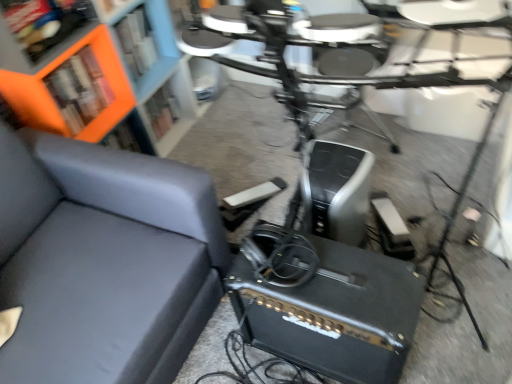
What are the coordinates of `orange matte bookcase at upper left` in the screenshot? It's located at (103, 81).

This screenshot has width=512, height=384. Find the location of `matte gray couch at left`. matte gray couch at left is located at coordinates (103, 261).

Image resolution: width=512 pixels, height=384 pixels. Describe the element at coordinates (325, 304) in the screenshot. I see `black matte speaker at lower center` at that location.

This screenshot has width=512, height=384. I want to click on orange matte bookshelf at upper left, so click(x=161, y=111).

This screenshot has height=384, width=512. I want to click on orange matte bookcase at upper left, so click(103, 81).

From the image's perspective, is orange matte bookshelf at upper left over black matte speaker at lower center?

Yes, from the image's perspective, orange matte bookshelf at upper left is over black matte speaker at lower center.

In the scene shown: Considering the sizes of objects orange matte bookshelf at upper left and black matte speaker at lower center in the image provided, who is thinner, orange matte bookshelf at upper left or black matte speaker at lower center?

With smaller width is orange matte bookshelf at upper left.

Is orange matte bookshelf at upper left to the left or to the right of black matte speaker at lower center in the image?

In the image, orange matte bookshelf at upper left appears on the left side of black matte speaker at lower center.

Considering the relative sizes of orange matte bookshelf at upper left and black matte speaker at lower center in the image provided, is orange matte bookshelf at upper left taller than black matte speaker at lower center?

In fact, orange matte bookshelf at upper left may be shorter than black matte speaker at lower center.

Does point (117, 50) come behind point (139, 190)?

That is True.

Would you say orange matte bookcase at upper left is to the left or to the right of matte gray couch at left in the picture?

In the image, orange matte bookcase at upper left appears on the right side of matte gray couch at left.

Considering the sizes of orange matte bookcase at upper left and matte gray couch at left in the image, is orange matte bookcase at upper left taller or shorter than matte gray couch at left?

orange matte bookcase at upper left is taller than matte gray couch at left.

How distant is orange matte bookcase at upper left from matte gray couch at left?

orange matte bookcase at upper left is 20.56 inches from matte gray couch at left.

Could you tell me if orange matte bookcase at upper left is facing orange matte bookshelf at upper left?

Yes.

From a real-world perspective, which is physically above, orange matte bookcase at upper left or orange matte bookshelf at upper left?

orange matte bookcase at upper left, from a real-world perspective.

Which is more to the right, orange matte bookcase at upper left or orange matte bookshelf at upper left?

orange matte bookshelf at upper left is more to the right.

Is point (137, 139) more distant than point (152, 127)?

No, it is not.

Is orange matte bookshelf at upper left surrounding orange matte bookcase at upper left?

No, orange matte bookcase at upper left is not surrounded by orange matte bookshelf at upper left.

From their relative heights in the image, would you say orange matte bookshelf at upper left is taller or shorter than orange matte bookcase at upper left?

orange matte bookshelf at upper left is shorter than orange matte bookcase at upper left.

I want to click on bookcase on the left of the orange matte bookshelf at upper left, so click(x=103, y=81).

Is orange matte bookshelf at upper left closer to the viewer compared to orange matte bookcase at upper left?

No, it is behind orange matte bookcase at upper left.

Are orange matte bookshelf at upper left and matte gray couch at left making contact?

No, orange matte bookshelf at upper left is not next to matte gray couch at left.

Is orange matte bookshelf at upper left not inside matte gray couch at left?

orange matte bookshelf at upper left lies outside matte gray couch at left's area.

Is orange matte bookshelf at upper left oriented towards matte gray couch at left?

No, orange matte bookshelf at upper left is not turned towards matte gray couch at left.

Is black matte speaker at lower center aimed at orange matte bookshelf at upper left?

No, black matte speaker at lower center is not oriented towards orange matte bookshelf at upper left.

From a real-world perspective, which is physically below, black matte speaker at lower center or orange matte bookshelf at upper left?

orange matte bookshelf at upper left.

Which object is thinner, black matte speaker at lower center or orange matte bookshelf at upper left?

Thinner between the two is orange matte bookshelf at upper left.

Which is in front, point (367, 334) or point (174, 100)?

Point (367, 334)

Looking at this image, is black matte speaker at lower center next to matte gray couch at left?

No.

Does black matte speaker at lower center appear on the right side of matte gray couch at left?

Indeed, black matte speaker at lower center is positioned on the right side of matte gray couch at left.

Is point (278, 292) positioned behind point (68, 321)?

No, (278, 292) is closer to viewer.

The height and width of the screenshot is (384, 512). Find the location of `shelf below the black matte speaker at lower center (from a real-world perspective)`. shelf below the black matte speaker at lower center (from a real-world perspective) is located at coordinates (161, 111).

You are a GUI agent. You are given a task and a screenshot of the screen. Output one action in this format:
    pyautogui.click(x=<x>, y=<y>)
    Task: Click on the chair located below the orange matte bookcase at upper left (from the image's perspective)
    
    Given the screenshot: What is the action you would take?
    pyautogui.click(x=103, y=261)

When comparing their distances from orange matte bookcase at upper left, does black matte speaker at lower center or matte gray couch at left seem closer?

matte gray couch at left lies closer to orange matte bookcase at upper left than the other object.

Which object lies further to the anchor point orange matte bookshelf at upper left, matte gray couch at left or black matte speaker at lower center?

Based on the image, black matte speaker at lower center appears to be further to orange matte bookshelf at upper left.

Which object lies nearer to the anchor point matte gray couch at left, black matte speaker at lower center or orange matte bookshelf at upper left?

black matte speaker at lower center is positioned closer to the anchor matte gray couch at left.

From the image, which object appears to be farther from matte gray couch at left, orange matte bookshelf at upper left or black matte speaker at lower center?

orange matte bookshelf at upper left lies further to matte gray couch at left than the other object.

When comparing their distances from orange matte bookshelf at upper left, does black matte speaker at lower center or orange matte bookcase at upper left seem closer?

orange matte bookcase at upper left.

Based on their spatial positions, is matte gray couch at left or black matte speaker at lower center further from orange matte bookcase at upper left?

black matte speaker at lower center.

Considering their positions, is orange matte bookcase at upper left positioned further to orange matte bookshelf at upper left than matte gray couch at left?

Based on the image, matte gray couch at left appears to be further to orange matte bookshelf at upper left.

Which object lies further to the anchor point orange matte bookshelf at upper left, black matte speaker at lower center or matte gray couch at left?

black matte speaker at lower center.

This screenshot has width=512, height=384. In order to click on bookcase between black matte speaker at lower center and orange matte bookshelf at upper left in the front-back direction in this screenshot , I will do `click(103, 81)`.

Where is `speaker between matte gray couch at left and orange matte bookshelf at upper left from front to back`? The width and height of the screenshot is (512, 384). speaker between matte gray couch at left and orange matte bookshelf at upper left from front to back is located at coordinates (325, 304).

Find the location of a particular element. chair between orange matte bookcase at upper left and black matte speaker at lower center from top to bottom is located at coordinates (103, 261).

Locate an element on the screen. The image size is (512, 384). bookcase between matte gray couch at left and orange matte bookshelf at upper left along the z-axis is located at coordinates (103, 81).